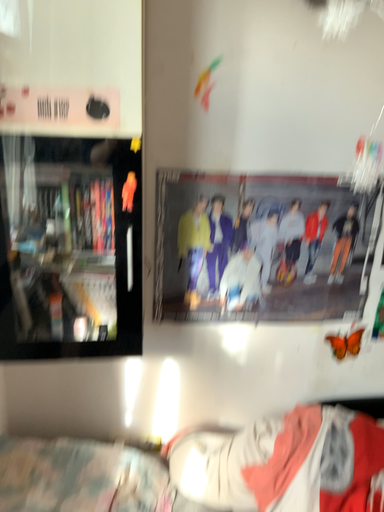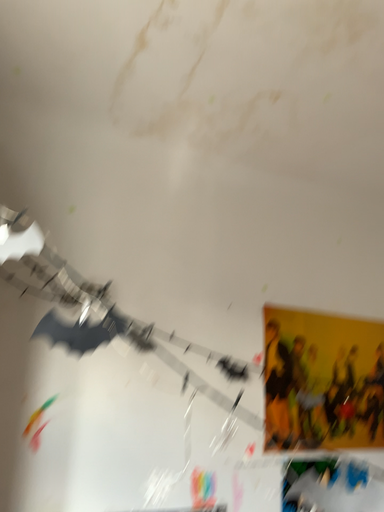
Question: Which way did the camera rotate in the video?

Choices:
 (A) rotated right
 (B) rotated left

Answer: (A)